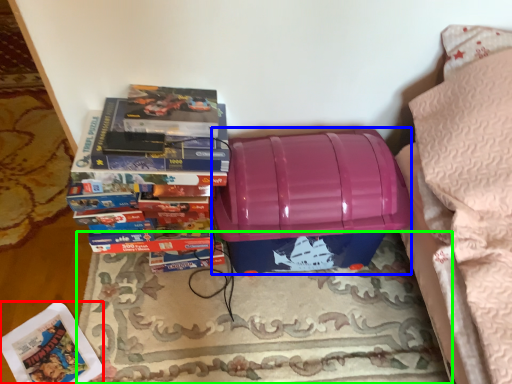
Question: Which object is the farthest from paperback book (highlighted by a red box)? Choose among these: storage box (highlighted by a blue box) or mat (highlighted by a green box).

Choices:
 (A) storage box
 (B) mat

Answer: (A)